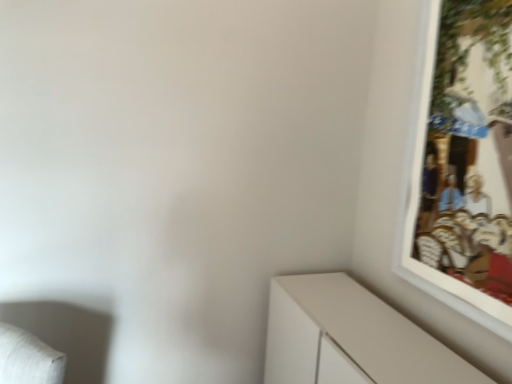
Where is `white matte picture frame at upper right`? This screenshot has width=512, height=384. white matte picture frame at upper right is located at coordinates (464, 163).

The width and height of the screenshot is (512, 384). Describe the element at coordinates (464, 163) in the screenshot. I see `white matte picture frame at upper right` at that location.

In order to click on white matte picture frame at upper right in this screenshot , I will do 464,163.